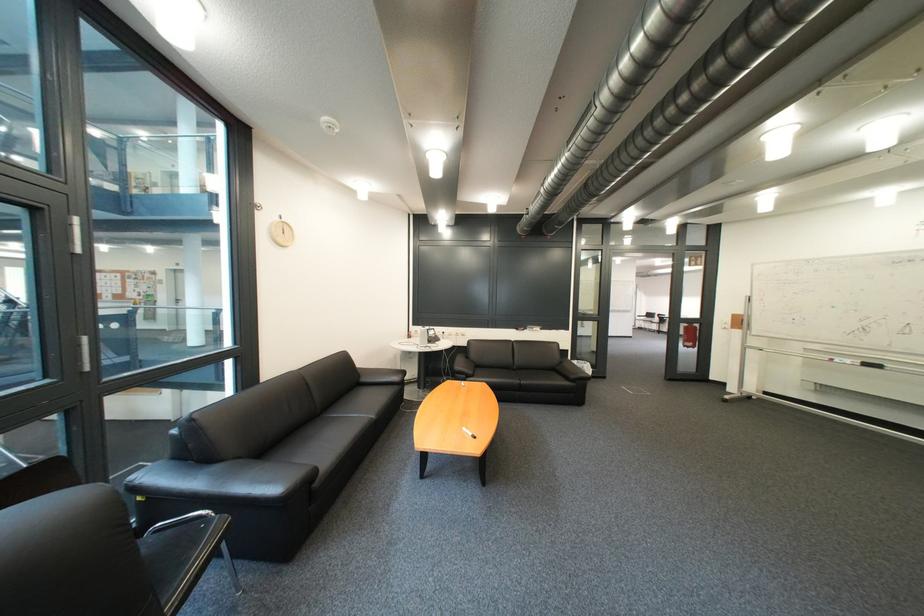
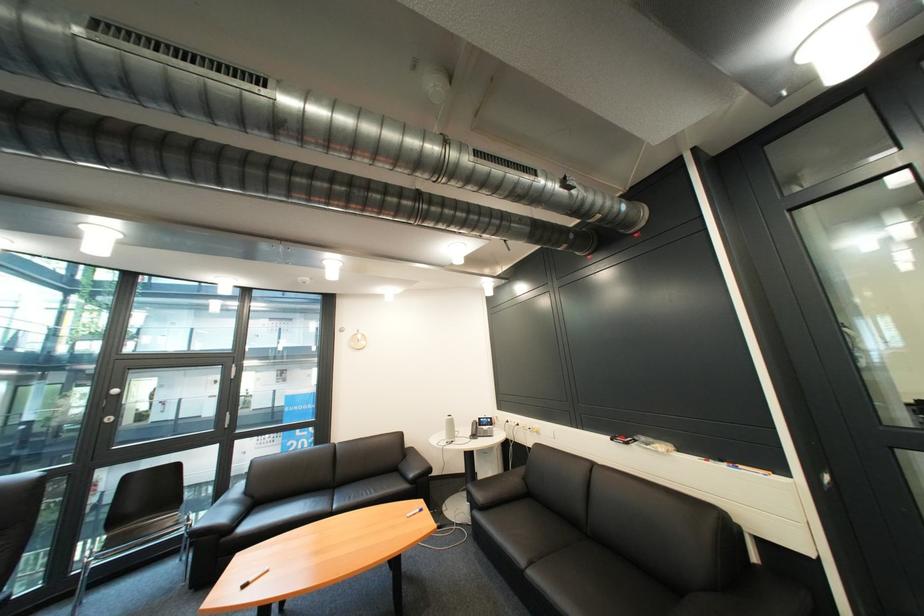
In the second image, find the point that corresponds to point 377,382 in the first image.

(414, 468)